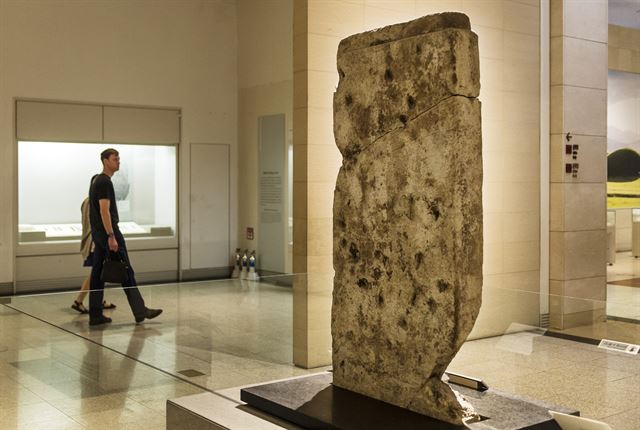
Where is `beige walls`? This screenshot has width=640, height=430. beige walls is located at coordinates (111, 64), (262, 68).